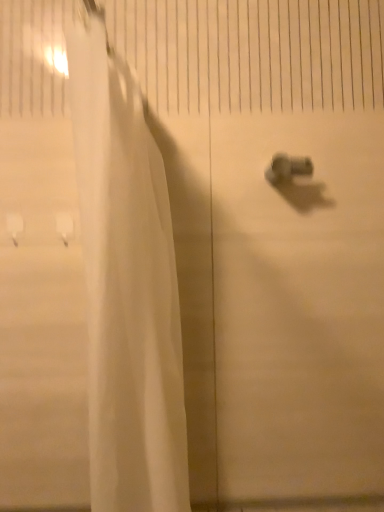
Describe the element at coordinates (287, 168) in the screenshot. I see `metallic gray door handle at upper right` at that location.

You are a GUI agent. You are given a task and a screenshot of the screen. Output one action in this format:
    pyautogui.click(x=<x>, y=<y>)
    Task: Click on the metallic gray door handle at upper right
    
    Given the screenshot: What is the action you would take?
    pyautogui.click(x=287, y=168)

This screenshot has width=384, height=512. Find the location of `metallic gray door handle at upper right`. metallic gray door handle at upper right is located at coordinates (287, 168).